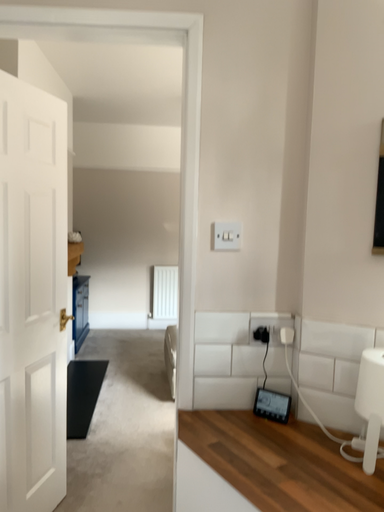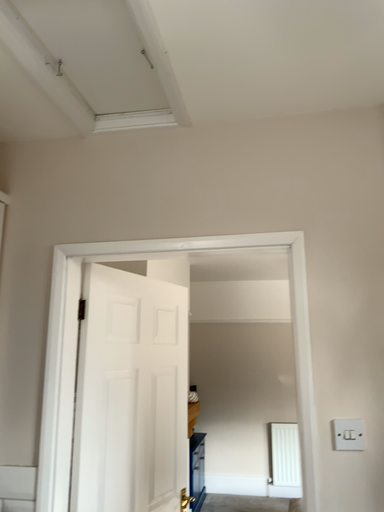
Question: How did the camera likely rotate when shooting the video?

Choices:
 (A) rotated upward
 (B) rotated downward

Answer: (A)